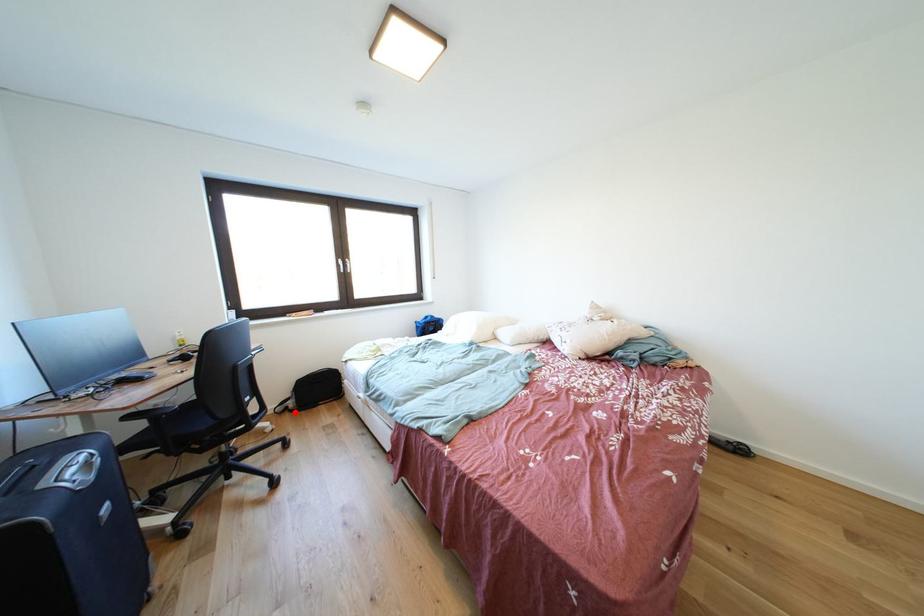
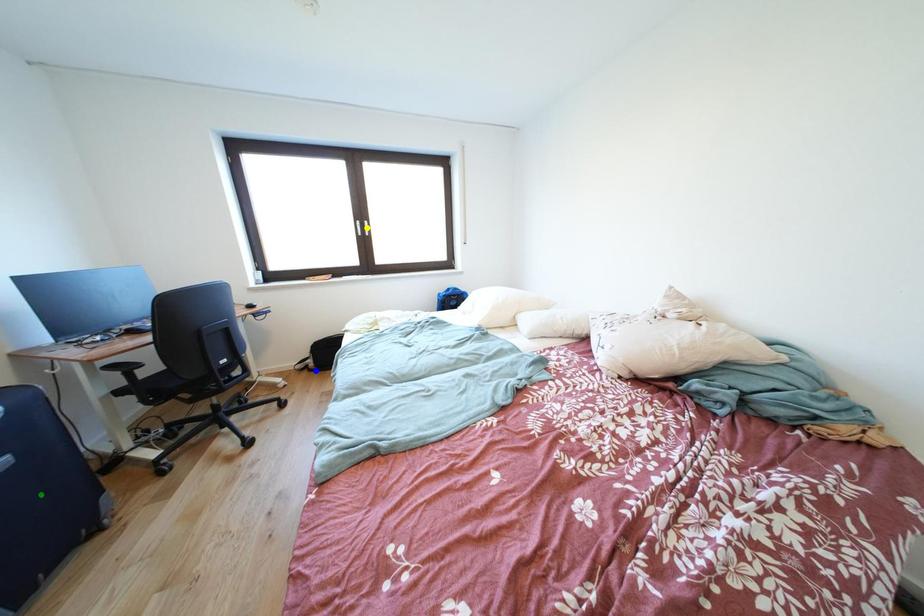
Question: I am providing you with two images of the same scene from different viewpoints. A red point is marked on the first image. You are given multiple points on the second image. Which point in image 2 is actually the same real-world point as the red point in image 1?

Choices:
 (A) blue point
 (B) yellow point
 (C) green point

Answer: (A)